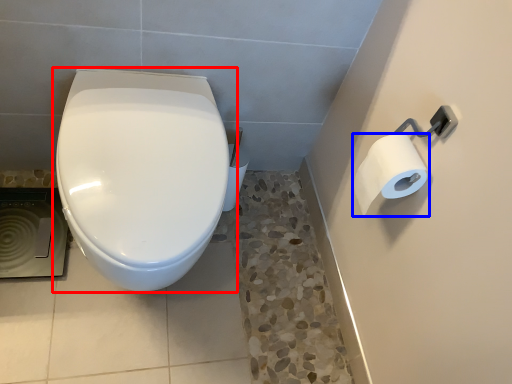
Question: Which object appears closest to the camera in this image, toilet (highlighted by a red box) or toilet paper (highlighted by a blue box)?

Choices:
 (A) toilet
 (B) toilet paper

Answer: (A)